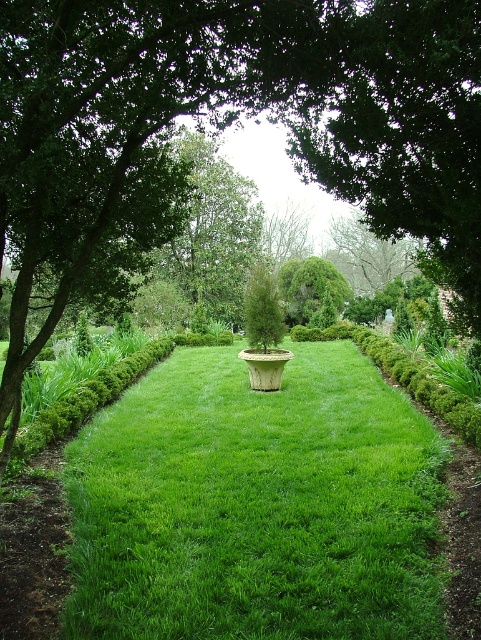
Question: Which of these objects is positioned farthest from the green leafy bush at center?

Choices:
 (A) green leafy tree at center
 (B) green textured bush at center
 (C) green grass at center
 (D) smooth bark tree at upper center

Answer: (C)

Question: Which object is positioned farthest from the green leafy bush at center?

Choices:
 (A) smooth bark tree at upper center
 (B) green textured bush at center

Answer: (A)

Question: Can you confirm if green leafy tree at center is smaller than green textured bush at center?

Choices:
 (A) no
 (B) yes

Answer: (B)

Question: Which of the following is the farthest from the observer?

Choices:
 (A) green leafy bush at center
 (B) smooth bark tree at upper center
 (C) green textured bush at center

Answer: (B)

Question: Can you confirm if smooth bark tree at upper center is thinner than green textured bush at center?

Choices:
 (A) yes
 (B) no

Answer: (A)

Question: In this image, where is green grass at center located relative to green textured bush at center?

Choices:
 (A) left
 (B) right

Answer: (B)